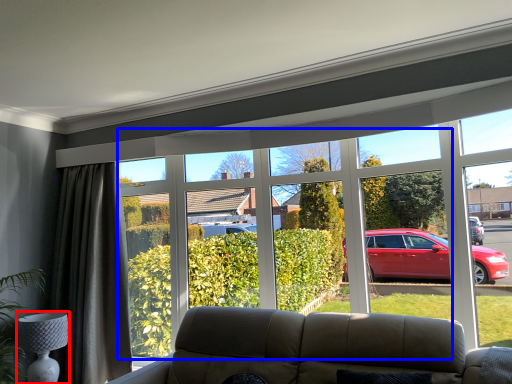
Question: Which point is further to the camera, lamp (highlighted by a red box) or bay window (highlighted by a blue box)?

Choices:
 (A) lamp
 (B) bay window

Answer: (A)